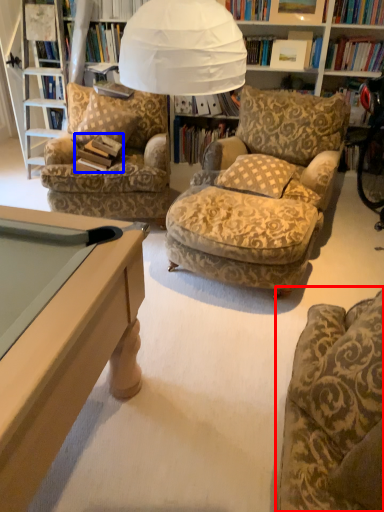
Question: Which point is closer to the camera, chair (highlighted by a red box) or book (highlighted by a blue box)?

Choices:
 (A) chair
 (B) book

Answer: (A)